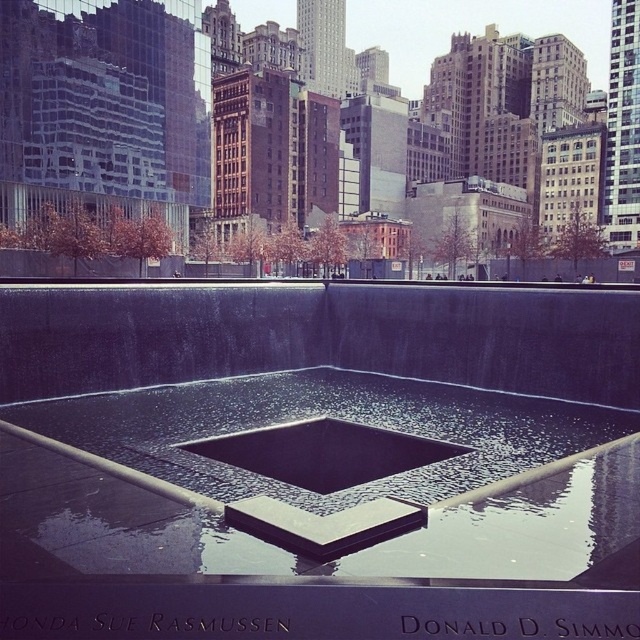
In the scene shown: Is black polished concrete water at center smaller than black textured water at center?

Incorrect, black polished concrete water at center is not smaller in size than black textured water at center.

Describe the element at coordinates (323, 426) in the screenshot. I see `black polished concrete water at center` at that location.

The image size is (640, 640). Describe the element at coordinates (323, 426) in the screenshot. I see `black polished concrete water at center` at that location.

Identify the location of black polished concrete water at center. (323, 426).